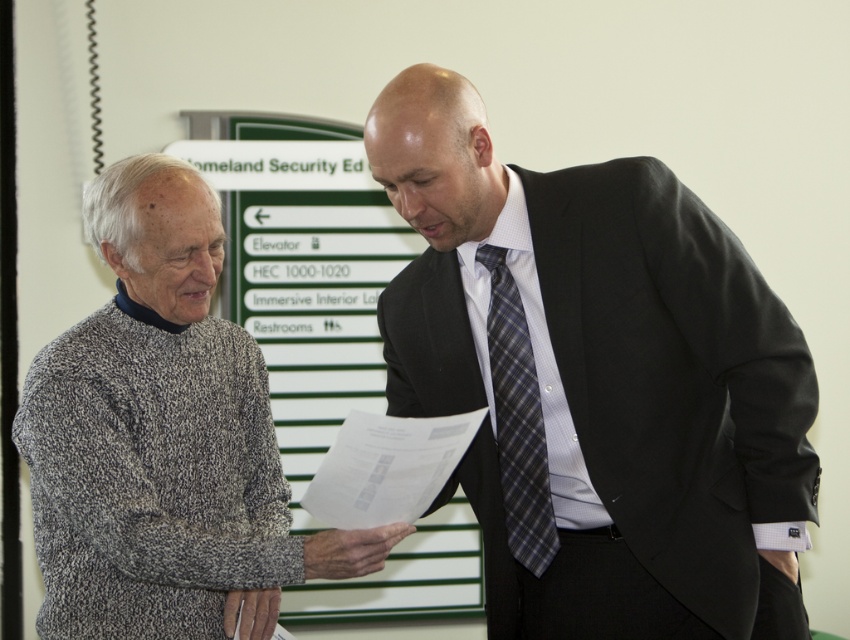
You are a delivery person who needs to place a package on the white paper at center without touching the speckled wool sweater at left. Is there enough space between them to do this safely?

The speckled wool sweater at left is 9.64 inches away from the white paper at center. Since the package can be placed on the white paper at center without encroaching into the 9.64 inches distance, there is sufficient space to avoid contact with the speckled wool sweater at left.

You are an interior designer assessing the visual balance between the speckled wool sweater at left and the plaid fabric tie at center. Based on their sizes, which object would you consider more dominant in the composition?

The speckled wool sweater at left is larger in size than the plaid fabric tie at center, making it the more dominant object in the composition.

What are the coordinates of the speckled wool sweater at left?

The coordinates of the speckled wool sweater at left are at point (x=163, y=440).